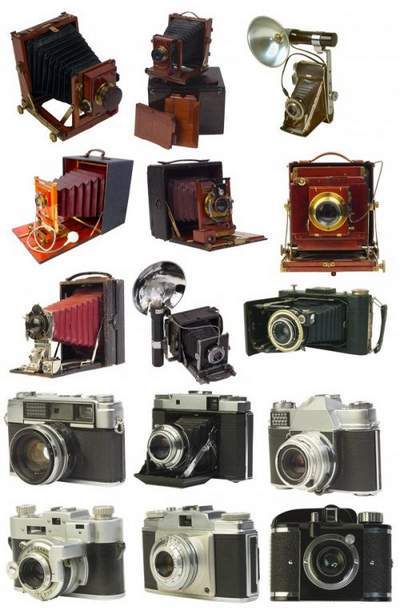
This screenshot has width=400, height=610. Find the location of `handle`. handle is located at coordinates (301, 512), (249, 446), (383, 325), (91, 271), (92, 149), (182, 157), (331, 149), (189, 10).